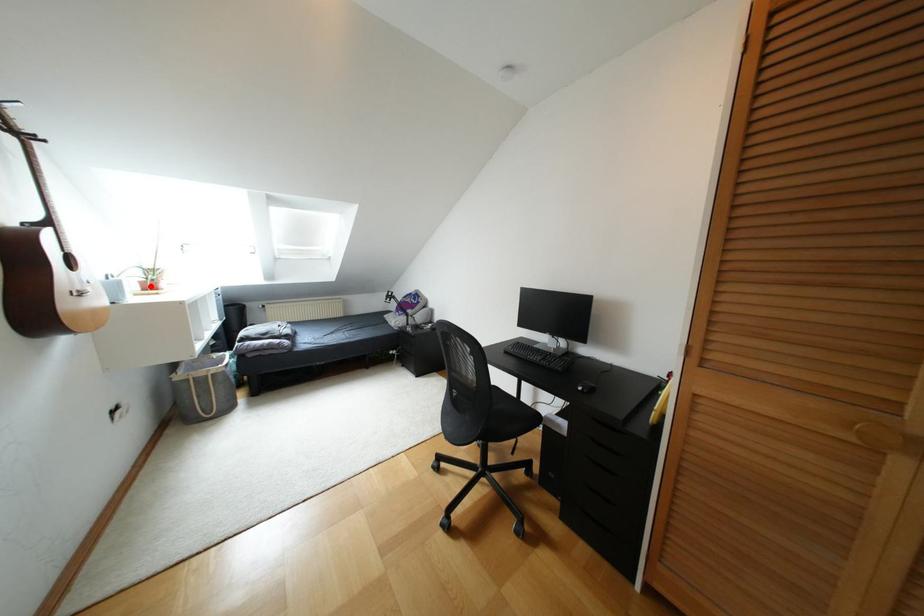
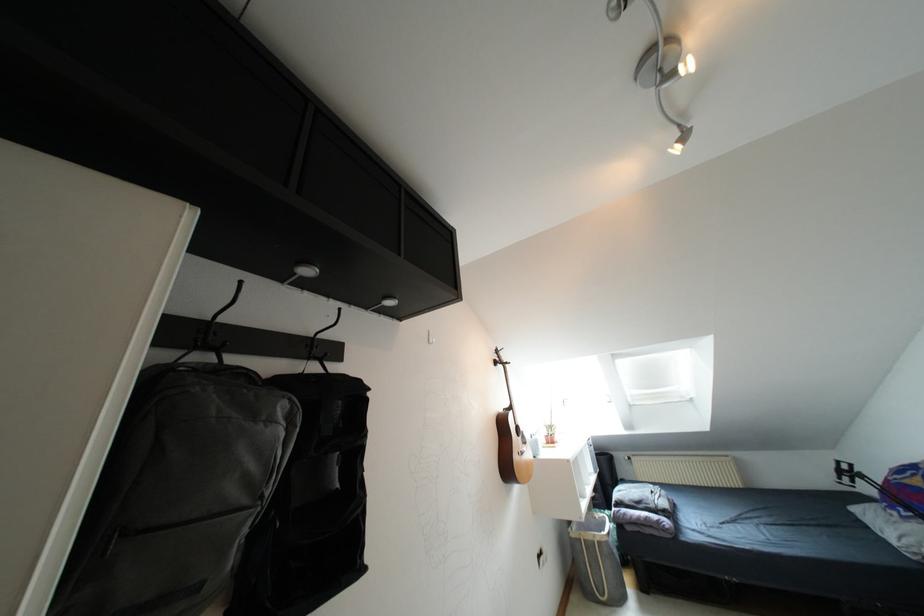
The point at the highlighted location is marked in the first image. Where is the corresponding point in the second image?

(550, 440)